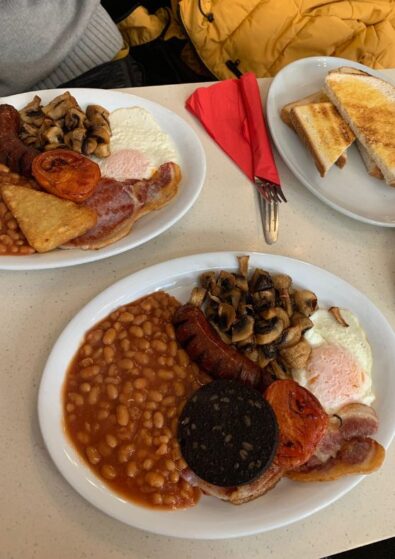
I want to click on table, so click(86, 523).